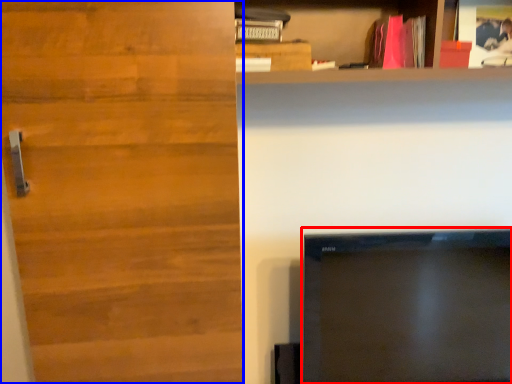
Question: Which point is further to the camera, television (highlighted by a red box) or door (highlighted by a blue box)?

Choices:
 (A) television
 (B) door

Answer: (A)